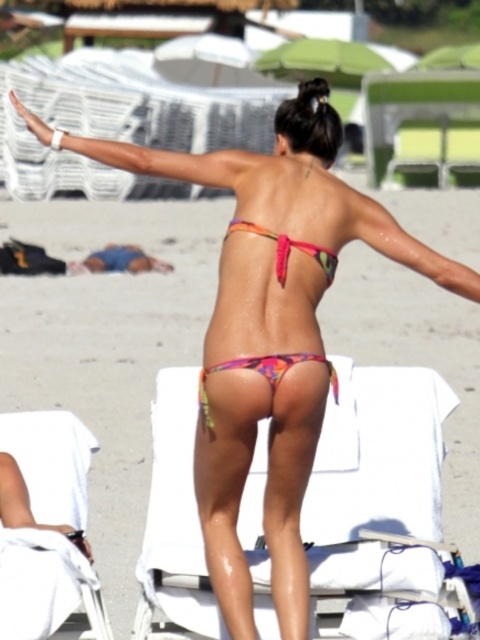
You are a beachgoer trying to find a spot to relax. You see a white fabric beach chair at lower left and a matte white arm at upper left. Which object is located closer to the ground?

The white fabric beach chair at lower left is positioned under the matte white arm at upper left, meaning it is closer to the ground.

You are a photographer setting up for a beach photoshoot. You need to position a model so they are between the white fabric beach chair at lower left and the matte white arm at upper left. Which object should the model be closer to to ensure they are in the foreground of the photo?

The model should be closer to the white fabric beach chair at lower left because it is closer to the viewer, so positioning the model near it will place them in the foreground.